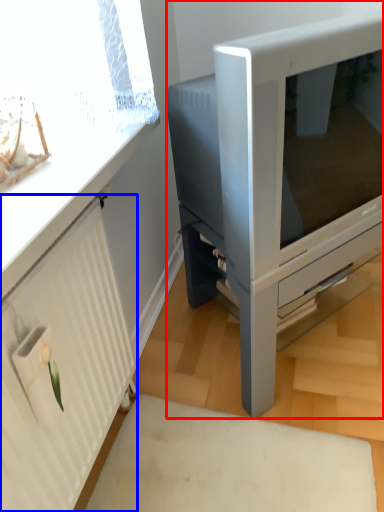
Question: Which object is further to the camera taking this photo, furniture (highlighted by a red box) or radiator (highlighted by a blue box)?

Choices:
 (A) furniture
 (B) radiator

Answer: (A)